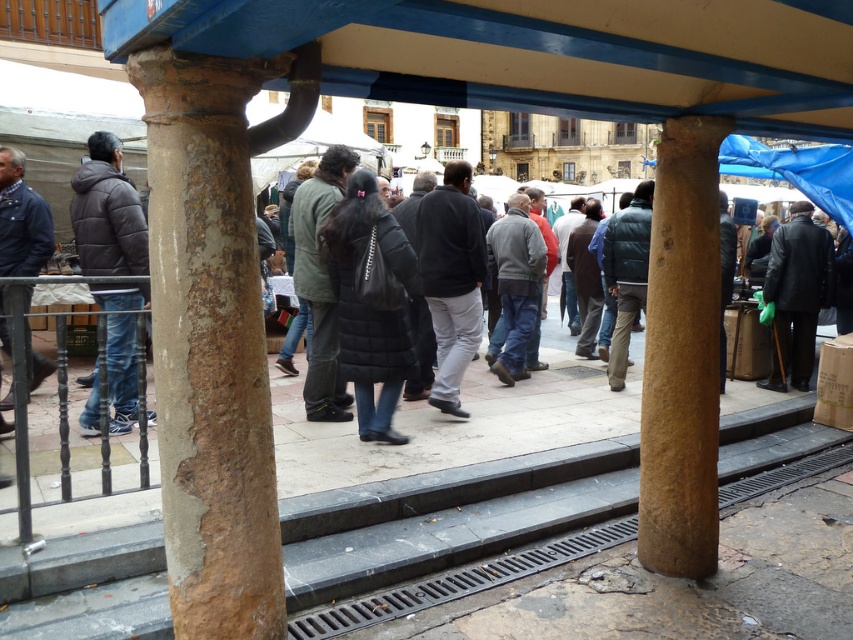
Who is positioned more to the right, leather jacket at right or gray woolen sweater at center?

leather jacket at right

Which of these two, leather jacket at right or gray woolen sweater at center, stands taller?

gray woolen sweater at center

Identify the location of leather jacket at right. (796, 296).

From the picture: Between rusty concrete pillar at left and dark blue jacket at left, which one appears on the right side from the viewer's perspective?

Positioned to the right is rusty concrete pillar at left.

The width and height of the screenshot is (853, 640). I want to click on rusty concrete pillar at left, so click(210, 346).

Where is `black puffer coat at center`? The image size is (853, 640). black puffer coat at center is located at coordinates (370, 301).

Can you confirm if black puffer coat at center is positioned above dark green puffy jacket at center?

No, black puffer coat at center is not above dark green puffy jacket at center.

Which is behind, point (346, 236) or point (331, 202)?

Positioned behind is point (331, 202).

Image resolution: width=853 pixels, height=640 pixels. Find the location of `black puffer coat at center`. black puffer coat at center is located at coordinates (370, 301).